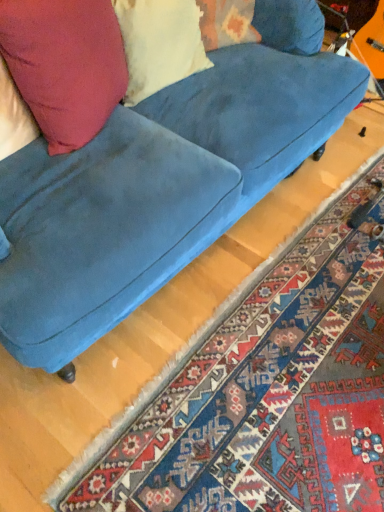
Measure the distance between matte pink pillow at upper left and camera.

A distance of 38.37 inches exists between matte pink pillow at upper left and camera.

Describe the element at coordinates (143, 161) in the screenshot. This screenshot has width=384, height=512. I see `velvet blue couch at center` at that location.

I want to click on matte pink pillow at upper left, so click(65, 65).

Does velvet blue couch at center have a smaller size compared to matte yellow pillow at upper left?

No.

From the image's perspective, is velvet blue couch at center located above or below matte yellow pillow at upper left?

Based on their image positions, velvet blue couch at center is located beneath matte yellow pillow at upper left.

Which object is closer to the camera taking this photo, velvet blue couch at center or matte yellow pillow at upper left?

Positioned in front is velvet blue couch at center.

Are velvet blue couch at center and matte yellow pillow at upper left beside each other?

No.

Is matte pink pillow at upper left in contact with velvet blue couch at center?

matte pink pillow at upper left is not next to velvet blue couch at center, and they're not touching.

Image resolution: width=384 pixels, height=512 pixels. I want to click on studio couch that appears in front of the matte pink pillow at upper left, so click(143, 161).

Can you confirm if matte pink pillow at upper left is positioned to the right of velvet blue couch at center?

No, matte pink pillow at upper left is not to the right of velvet blue couch at center.

Is matte pink pillow at upper left positioned with its back to velvet blue couch at center?

That's right, matte pink pillow at upper left is facing away from velvet blue couch at center.

From the picture: Is carpet with intricate patterns at lower right directly adjacent to velvet blue couch at center?

No, carpet with intricate patterns at lower right is not touching velvet blue couch at center.

Can you tell me how much carpet with intricate patterns at lower right and velvet blue couch at center differ in facing direction?

There is a 90.7-degree angle between the facing directions of carpet with intricate patterns at lower right and velvet blue couch at center.

From a real-world perspective, is carpet with intricate patterns at lower right on velvet blue couch at center?

Actually, carpet with intricate patterns at lower right is physically below velvet blue couch at center in the real world.

Does carpet with intricate patterns at lower right have a lesser height compared to velvet blue couch at center?

Correct, carpet with intricate patterns at lower right is not as tall as velvet blue couch at center.

Is carpet with intricate patterns at lower right inside or outside of matte pink pillow at upper left?

carpet with intricate patterns at lower right cannot be found inside matte pink pillow at upper left.

Measure the distance from carpet with intricate patterns at lower right to matte pink pillow at upper left.

They are 87.67 centimeters apart.

From the image's perspective, which is below, carpet with intricate patterns at lower right or matte pink pillow at upper left?

From the image's view, carpet with intricate patterns at lower right is below.

Which is more distant, (97, 125) or (143, 23)?

Positioned behind is point (143, 23).

Is matte yellow pillow at upper left at the back of matte pink pillow at upper left?

matte pink pillow at upper left does not have its back to matte yellow pillow at upper left.

Is matte pink pillow at upper left taller than matte yellow pillow at upper left?

Yes.

From the picture: From a real-world perspective, is matte pink pillow at upper left below matte yellow pillow at upper left?

Actually, matte pink pillow at upper left is physically above matte yellow pillow at upper left in the real world.

Is carpet with intricate patterns at lower right looking in the opposite direction of matte yellow pillow at upper left?

No, matte yellow pillow at upper left is not at the back of carpet with intricate patterns at lower right.

Is carpet with intricate patterns at lower right not inside matte yellow pillow at upper left?

That's correct, carpet with intricate patterns at lower right is outside of matte yellow pillow at upper left.

From a real-world perspective, which object rests below the other?

carpet with intricate patterns at lower right is physically lower.

Image resolution: width=384 pixels, height=512 pixels. I want to click on pillow positioned vertically above the carpet with intricate patterns at lower right (from a real-world perspective), so click(x=159, y=44).

From the image's perspective, who appears lower, matte yellow pillow at upper left or velvet blue couch at center?

velvet blue couch at center, from the image's perspective.

Is point (143, 93) positioned before point (112, 250)?

No, it is behind (112, 250).

Would you say matte yellow pillow at upper left is to the left or to the right of velvet blue couch at center in the picture?

From the image, it's evident that matte yellow pillow at upper left is to the right of velvet blue couch at center.

In the image, is matte yellow pillow at upper left positioned in front of or behind velvet blue couch at center?

Clearly, matte yellow pillow at upper left is behind velvet blue couch at center.

At what (x,y) coordinates should I click in order to perform the action: click on pillow that is on the right side of velvet blue couch at center. Please return your answer as a coordinate pair (x, y). The height and width of the screenshot is (512, 384). Looking at the image, I should click on (159, 44).

Image resolution: width=384 pixels, height=512 pixels. What are the coordinates of `throw pillow above the velvet blue couch at center (from the image's perspective)` in the screenshot? It's located at (65, 65).

From the image, which object appears to be nearer to velvet blue couch at center, matte yellow pillow at upper left or carpet with intricate patterns at lower right?

Among the two, matte yellow pillow at upper left is located nearer to velvet blue couch at center.

Estimate the real-world distances between objects in this image. Which object is further from velvet blue couch at center, carpet with intricate patterns at lower right or matte pink pillow at upper left?

carpet with intricate patterns at lower right is positioned further to the anchor velvet blue couch at center.

When comparing their distances from carpet with intricate patterns at lower right, does velvet blue couch at center or matte yellow pillow at upper left seem closer?

velvet blue couch at center is closer to carpet with intricate patterns at lower right.

Based on their spatial positions, is carpet with intricate patterns at lower right or velvet blue couch at center further from matte yellow pillow at upper left?

carpet with intricate patterns at lower right.

Based on their spatial positions, is matte yellow pillow at upper left or carpet with intricate patterns at lower right further from matte pink pillow at upper left?

carpet with intricate patterns at lower right.

Considering their positions, is carpet with intricate patterns at lower right positioned closer to matte pink pillow at upper left than velvet blue couch at center?

The object closer to matte pink pillow at upper left is velvet blue couch at center.

Based on their spatial positions, is matte pink pillow at upper left or velvet blue couch at center further from carpet with intricate patterns at lower right?

matte pink pillow at upper left lies further to carpet with intricate patterns at lower right than the other object.

In the scene shown: Based on their spatial positions, is matte yellow pillow at upper left or velvet blue couch at center further from matte pink pillow at upper left?

matte yellow pillow at upper left is further to matte pink pillow at upper left.

This screenshot has height=512, width=384. I want to click on throw pillow positioned between velvet blue couch at center and matte yellow pillow at upper left from near to far, so click(65, 65).

The height and width of the screenshot is (512, 384). What are the coordinates of `studio couch situated between matte pink pillow at upper left and carpet with intricate patterns at lower right from left to right` in the screenshot? It's located at (143, 161).

Find the location of a particular element. This screenshot has height=512, width=384. studio couch between matte yellow pillow at upper left and carpet with intricate patterns at lower right in the up-down direction is located at coordinates (143, 161).

What are the coordinates of `throw pillow between matte yellow pillow at upper left and carpet with intricate patterns at lower right in the up-down direction` in the screenshot? It's located at (65, 65).